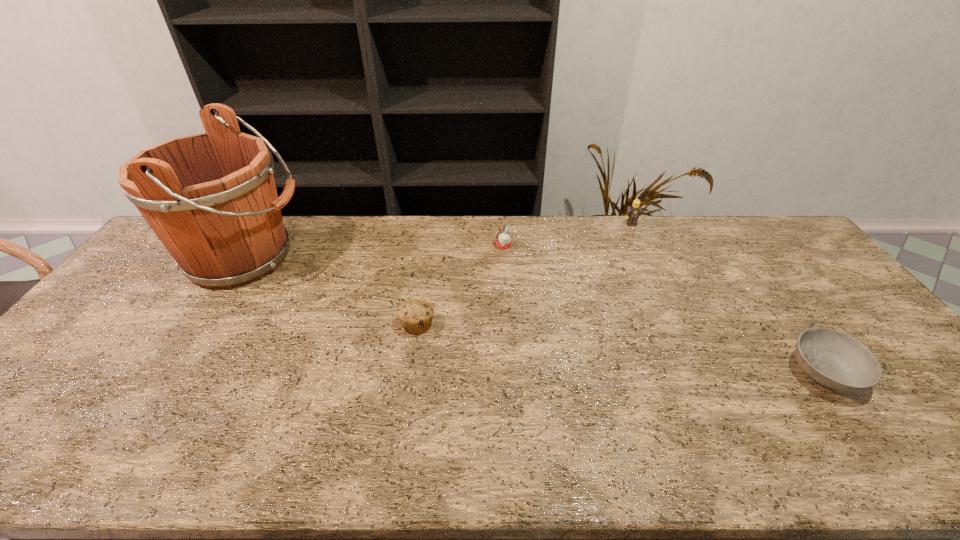
The height and width of the screenshot is (540, 960). I want to click on the tallest object, so click(211, 198).

Locate an element on the screen. The image size is (960, 540). bucket is located at coordinates (211, 198).

Locate an element on the screen. Image resolution: width=960 pixels, height=540 pixels. Lego is located at coordinates (634, 212).

At what (x,y) coordinates should I click in order to perform the action: click on the second object from right to left. Please return your answer as a coordinate pair (x, y). The width and height of the screenshot is (960, 540). Looking at the image, I should click on (634, 212).

Where is `the farther muffin`? The width and height of the screenshot is (960, 540). the farther muffin is located at coordinates (503, 239).

The image size is (960, 540). In order to click on the third object from right to left in this screenshot , I will do `click(503, 239)`.

The image size is (960, 540). Find the location of `the left muffin`. the left muffin is located at coordinates (415, 316).

Find the location of a particular element. Image resolution: width=960 pixels, height=540 pixels. the fourth object from right to left is located at coordinates (415, 316).

Where is `the nearest object`? the nearest object is located at coordinates (833, 359).

Locate an element on the screen. Image resolution: width=960 pixels, height=540 pixels. bowl is located at coordinates (833, 359).